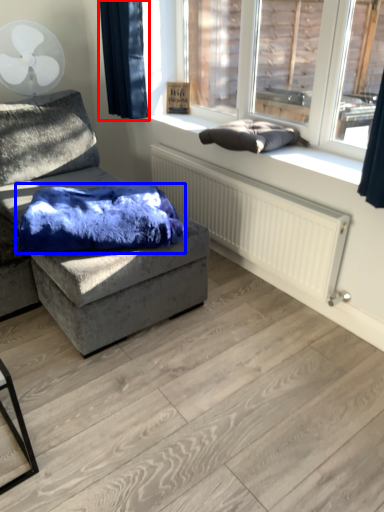
Question: Which object is further to the camera taking this photo, curtain (highlighted by a red box) or material (highlighted by a blue box)?

Choices:
 (A) curtain
 (B) material

Answer: (A)